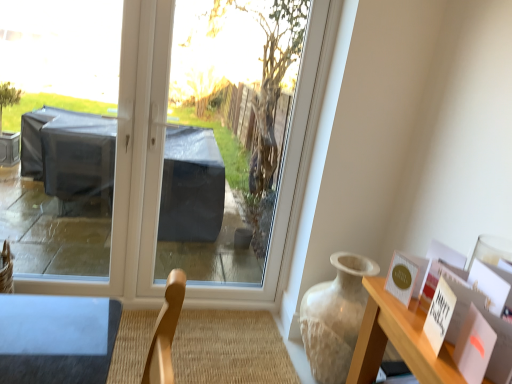
Question: Considering the relative sizes of matte gold postcard at upper right and transparent plastic window screen at center in the image provided, is matte gold postcard at upper right thinner than transparent plastic window screen at center?

Choices:
 (A) no
 (B) yes

Answer: (B)

Question: Considering the relative positions of matte gold postcard at upper right and transparent plastic window screen at center in the image provided, is matte gold postcard at upper right in front of transparent plastic window screen at center?

Choices:
 (A) no
 (B) yes

Answer: (B)

Question: Can you confirm if matte gold postcard at upper right is smaller than transparent plastic window screen at center?

Choices:
 (A) no
 (B) yes

Answer: (B)

Question: Is matte gold postcard at upper right taller than transparent plastic window screen at center?

Choices:
 (A) no
 (B) yes

Answer: (A)

Question: Considering the relative positions of matte gold postcard at upper right and transparent plastic window screen at center in the image provided, is matte gold postcard at upper right to the right of transparent plastic window screen at center from the viewer's perspective?

Choices:
 (A) yes
 (B) no

Answer: (A)

Question: From the image's perspective, is matte gold postcard at upper right located above transparent plastic window screen at center?

Choices:
 (A) no
 (B) yes

Answer: (A)

Question: Is matte beige vase at right completely or partially inside transparent plastic window screen at center?

Choices:
 (A) yes
 (B) no

Answer: (B)

Question: Is the surface of transparent plastic window screen at center in direct contact with matte beige vase at right?

Choices:
 (A) yes
 (B) no

Answer: (B)

Question: Does transparent plastic window screen at center lie behind matte beige vase at right?

Choices:
 (A) no
 (B) yes

Answer: (B)

Question: Can you confirm if transparent plastic window screen at center is wider than matte beige vase at right?

Choices:
 (A) no
 (B) yes

Answer: (A)

Question: Can you confirm if transparent plastic window screen at center is smaller than matte beige vase at right?

Choices:
 (A) yes
 (B) no

Answer: (B)

Question: From the image's perspective, is transparent plastic window screen at center under matte beige vase at right?

Choices:
 (A) yes
 (B) no

Answer: (B)

Question: Is transparent plastic at center positioned with its back to matte gold postcard at upper right?

Choices:
 (A) no
 (B) yes

Answer: (A)